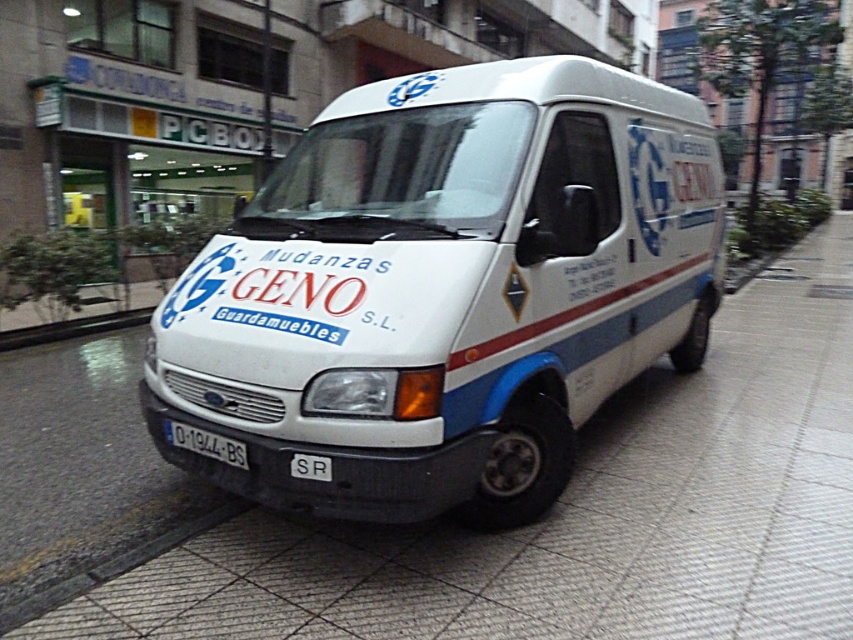
Can you confirm if white matte van at center is positioned above white tile pavement at center?

Yes.

Locate an element on the screen. white matte van at center is located at coordinates (445, 291).

Does white matte van at center appear on the right side of white plastic license plate at center?

Indeed, white matte van at center is positioned on the right side of white plastic license plate at center.

Can you confirm if white matte van at center is smaller than white plastic license plate at center?

Actually, white matte van at center might be larger than white plastic license plate at center.

The width and height of the screenshot is (853, 640). Find the location of `white matte van at center`. white matte van at center is located at coordinates (445, 291).

Can you confirm if white tile pavement at center is positioned to the right of white plastic license plate at center?

Correct, you'll find white tile pavement at center to the right of white plastic license plate at center.

This screenshot has height=640, width=853. I want to click on white tile pavement at center, so click(x=454, y=528).

Where is `white tile pavement at center`? Image resolution: width=853 pixels, height=640 pixels. white tile pavement at center is located at coordinates (454, 528).